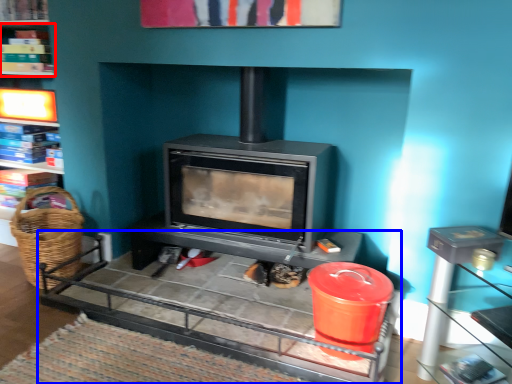
Question: Among these objects, which one is nearest to the camera, shelf (highlighted by a red box) or table (highlighted by a blue box)?

Choices:
 (A) shelf
 (B) table

Answer: (B)